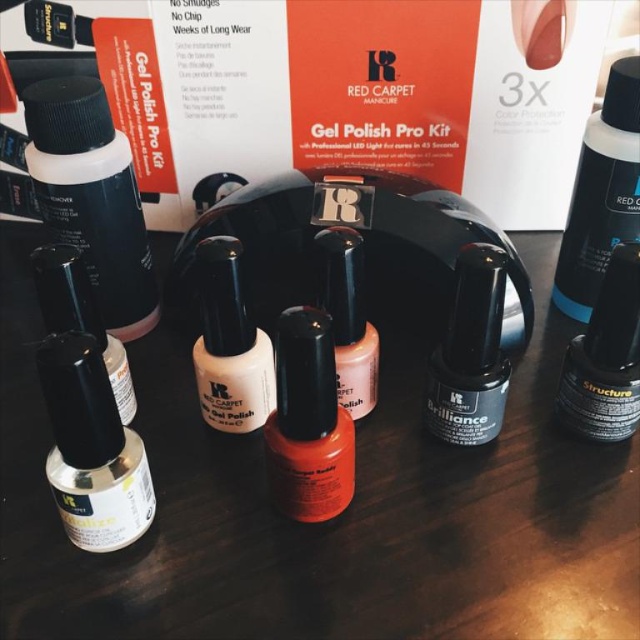
Which of these two, black matte bottle at upper left or shiny orange nail polish at center, stands shorter?

shiny orange nail polish at center is shorter.

Is point (140, 232) positioned after point (291, 358)?

That is True.

Does point (86, 236) lie in front of point (275, 440)?

That is False.

Locate an element on the screen. The width and height of the screenshot is (640, 640). black matte bottle at upper left is located at coordinates (92, 196).

Is point (266, 422) positioned behind point (346, 358)?

Yes, it is behind point (346, 358).

Which of these two, shiny orange nail polish at center or matte black nail polish at center, stands shorter?

With less height is shiny orange nail polish at center.

Between point (332, 468) and point (342, 332), which one is positioned in front?

Positioned in front is point (332, 468).

Where is `shiny orange nail polish at center`? The width and height of the screenshot is (640, 640). shiny orange nail polish at center is located at coordinates (307, 420).

Which is below, matte black structure at center or matte black nail polish at lower left?

matte black nail polish at lower left

Which is more to the right, matte black structure at center or matte black nail polish at lower left?

Positioned to the right is matte black structure at center.

Where is `matte black structure at center`? Image resolution: width=640 pixels, height=640 pixels. matte black structure at center is located at coordinates (605, 356).

This screenshot has height=640, width=640. Identify the location of matte black structure at center. (605, 356).